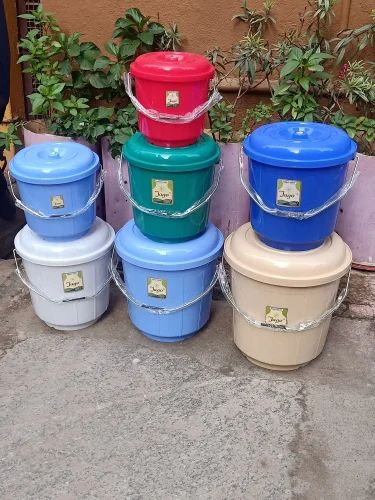
Find the location of a particular element. blue bucket is located at coordinates (311, 179).